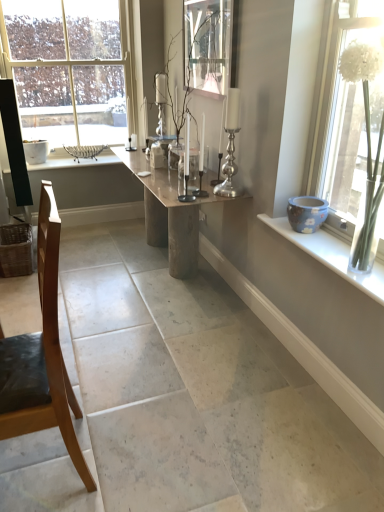
Question: Should I look upward or downward to see silver metallic candle holder at center, the first candle holder from the right?

Choices:
 (A) down
 (B) up

Answer: (B)

Question: Does clear glass window at upper left, the 2th window positioned from the front, appear on the right side of clear glass candle holder at center, which ranks as the 1th candle holder in left-to-right order?

Choices:
 (A) no
 (B) yes

Answer: (A)

Question: Are clear glass window at upper left, the 2th window from the bottom, and clear glass candle holder at center, the second candle holder viewed from the right, far apart?

Choices:
 (A) yes
 (B) no

Answer: (A)

Question: Considering the relative positions of clear glass window at upper left, the 2th window from the bottom, and clear glass candle holder at center, which ranks as the 1th candle holder in left-to-right order, in the image provided, is clear glass window at upper left, the 2th window from the bottom, to the left of clear glass candle holder at center, which ranks as the 1th candle holder in left-to-right order, from the viewer's perspective?

Choices:
 (A) yes
 (B) no

Answer: (A)

Question: Does clear glass window at upper left, the 2th window positioned from the front, have a greater width compared to clear glass candle holder at center, the second candle holder viewed from the right?

Choices:
 (A) no
 (B) yes

Answer: (B)

Question: From a real-world perspective, does clear glass window at upper left, the 2th window positioned from the front, sit lower than clear glass candle holder at center, the second candle holder viewed from the right?

Choices:
 (A) no
 (B) yes

Answer: (A)

Question: From the image's perspective, is clear glass window at upper left, the 2th window from the bottom, under clear glass candle holder at center, which ranks as the 1th candle holder in left-to-right order?

Choices:
 (A) yes
 (B) no

Answer: (B)

Question: Is clear glass window at upper left, the 2th window when ordered from right to left, aimed at blue ceramic pot at right?

Choices:
 (A) no
 (B) yes

Answer: (B)

Question: Is clear glass window at upper left, which ranks as the 1th window in back-to-front order, taller than blue ceramic pot at right?

Choices:
 (A) yes
 (B) no

Answer: (A)

Question: Is clear glass window at upper left, the 2th window from the bottom, positioned with its back to blue ceramic pot at right?

Choices:
 (A) no
 (B) yes

Answer: (A)

Question: Does clear glass window at upper left, the 2th window when ordered from right to left, have a greater width compared to blue ceramic pot at right?

Choices:
 (A) no
 (B) yes

Answer: (A)

Question: Considering the relative positions of clear glass window at upper left, the 2th window from the bottom, and blue ceramic pot at right in the image provided, is clear glass window at upper left, the 2th window from the bottom, to the right of blue ceramic pot at right from the viewer's perspective?

Choices:
 (A) yes
 (B) no

Answer: (B)

Question: Can you confirm if clear glass window at upper left, the 2th window positioned from the front, is bigger than blue ceramic pot at right?

Choices:
 (A) no
 (B) yes

Answer: (B)

Question: Can you confirm if silver metallic candle holder at center, the 2th candle holder viewed from the left, is taller than clear glass vase at right, which is the second window in back-to-front order?

Choices:
 (A) no
 (B) yes

Answer: (A)